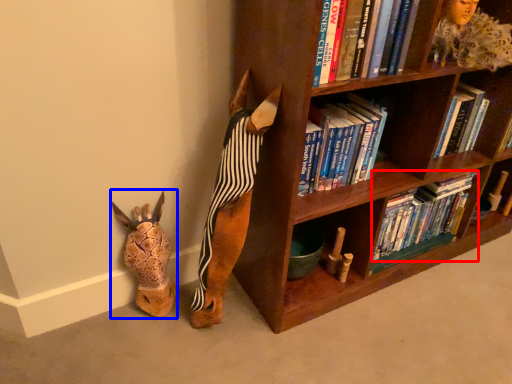
Question: Which of the following is the farthest to the observer, book (highlighted by a red box) or animal (highlighted by a blue box)?

Choices:
 (A) book
 (B) animal

Answer: (A)